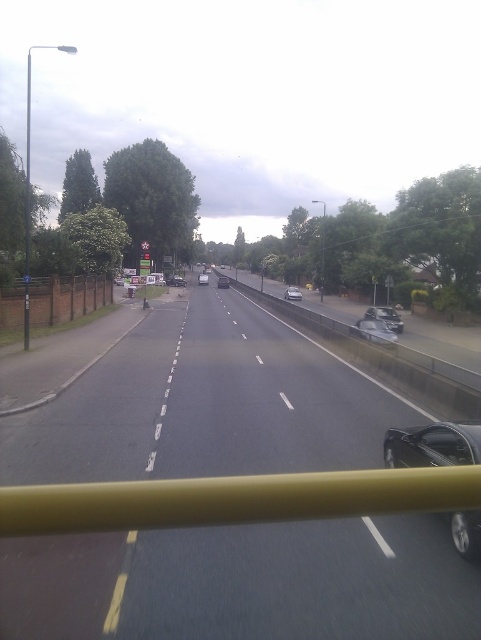
Question: Which of the following is the farthest from the observer?

Choices:
 (A) (301, 296)
 (B) (384, 307)

Answer: (A)

Question: Which of the following is the closest to the observer?

Choices:
 (A) black asphalt road at center
 (B) white matte van at center
 (C) shiny silver car at right

Answer: (A)

Question: Can you confirm if black asphalt highway at center is wider than shiny silver car at right?

Choices:
 (A) no
 (B) yes

Answer: (B)

Question: Which point is farther to the camera?

Choices:
 (A) metallic silver car at right
 (B) white matte van at center
 (C) matte black car at center
 (D) black asphalt highway at center

Answer: (C)

Question: Does silver metallic sedan at center have a greater width compared to silver metallic van at center?

Choices:
 (A) yes
 (B) no

Answer: (B)

Question: Is metallic silver car at right smaller than white matte van at center?

Choices:
 (A) yes
 (B) no

Answer: (B)